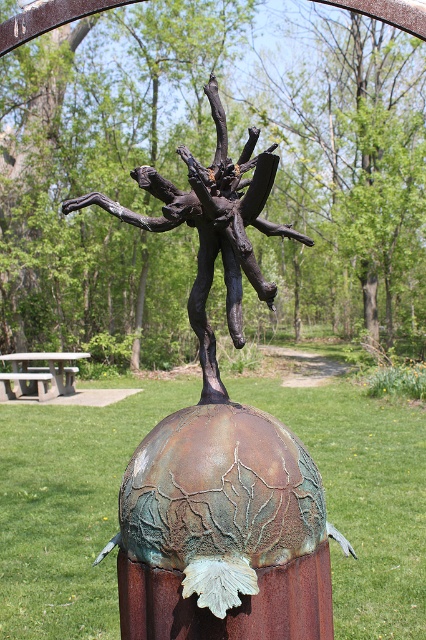
Question: Among these objects, which one is farthest from the camera?

Choices:
 (A) gray concrete picnic table at lower left
 (B) rusty metal sculpture at center

Answer: (A)

Question: Is the position of rusty metal sculpture at center more distant than that of gray concrete picnic table at lower left?

Choices:
 (A) no
 (B) yes

Answer: (A)

Question: Which of the following is the farthest from the observer?

Choices:
 (A) (178, 632)
 (B) (34, 365)

Answer: (B)

Question: Is rusty metal sculpture at center wider than gray concrete picnic table at lower left?

Choices:
 (A) yes
 (B) no

Answer: (B)

Question: Which point appears closest to the camera in this image?

Choices:
 (A) (207, 216)
 (B) (49, 358)

Answer: (A)

Question: Can you confirm if rusty metal sculpture at center is wider than gray concrete picnic table at lower left?

Choices:
 (A) no
 (B) yes

Answer: (A)